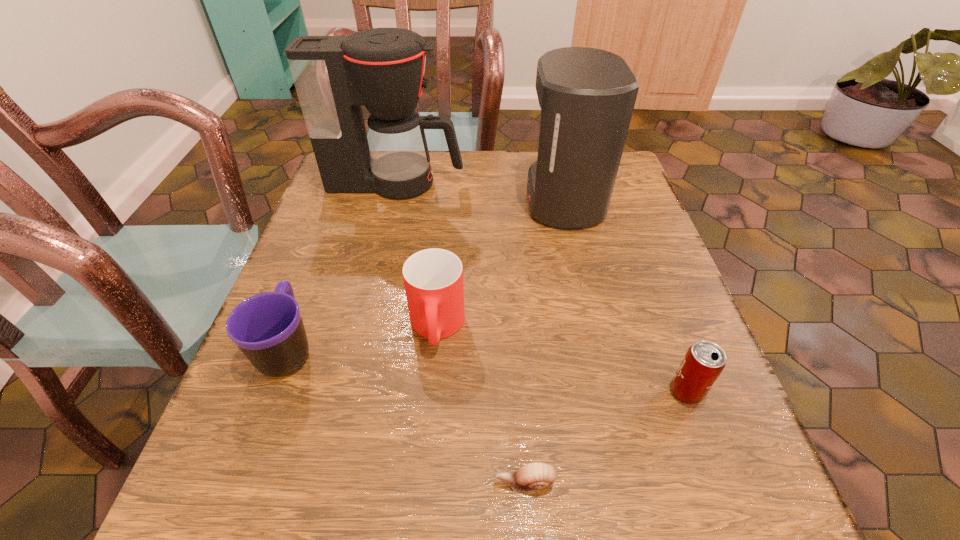
You are a GUI agent. You are given a task and a screenshot of the screen. Output one action in this format:
    pyautogui.click(x=<x>, y=<y>)
    Task: Click on the free space at the far left corner of the desktop
    This screenshot has width=960, height=540.
    Given the screenshot: What is the action you would take?
    pyautogui.click(x=345, y=198)

Identify the location of empty location between the mug and the left coffee maker. (342, 266).

This screenshot has width=960, height=540. In order to click on free area in between the cup and the rightmost object in this screenshot , I will do `click(562, 359)`.

You are a GUI agent. You are given a task and a screenshot of the screen. Output one action in this format:
    pyautogui.click(x=<x>, y=<y>)
    Task: Click on the free area in between the cup and the right coffee maker
    Image resolution: width=960 pixels, height=540 pixels.
    Given the screenshot: What is the action you would take?
    pyautogui.click(x=500, y=264)

Identify the location of free space between the mug and the left coffee maker. The height and width of the screenshot is (540, 960). (342, 266).

Locate an element on the screen. Image resolution: width=960 pixels, height=540 pixels. free spot between the mug and the cup is located at coordinates (363, 338).

The image size is (960, 540). In order to click on vacant area that lies between the mug and the cup in this screenshot , I will do `click(363, 338)`.

Find the location of a particular element. The image size is (960, 540). empty location between the nearest object and the fifth object from left to right is located at coordinates (544, 341).

The width and height of the screenshot is (960, 540). I want to click on blank region between the left coffee maker and the shortest object, so click(x=461, y=333).

This screenshot has width=960, height=540. Find the location of `empty space that is in between the right coffee maker and the rightmost object`. empty space that is in between the right coffee maker and the rightmost object is located at coordinates pyautogui.click(x=625, y=296).